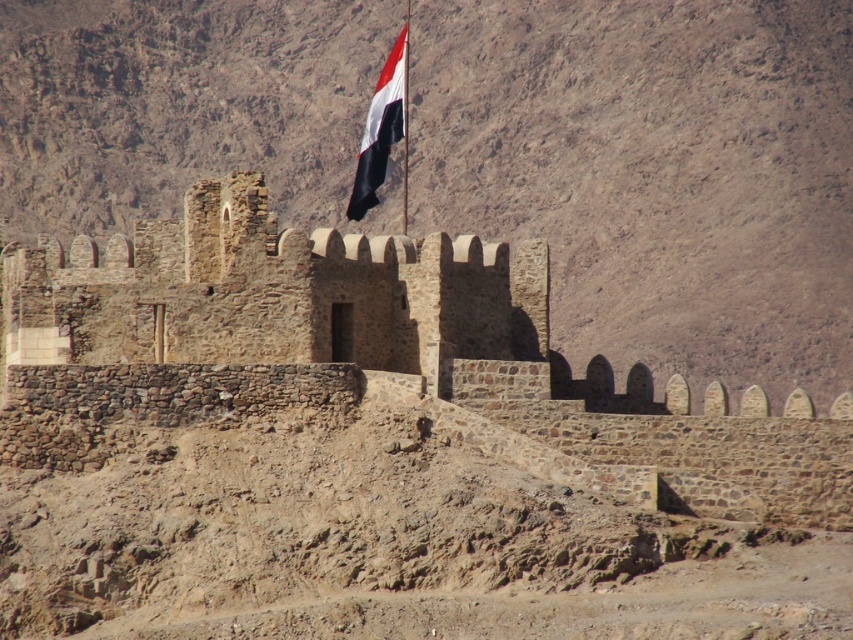
Is rustic stone castle at center wider than white fabric flag at upper center?

Correct, the width of rustic stone castle at center exceeds that of white fabric flag at upper center.

Which is below, rustic stone castle at center or white fabric flag at upper center?

rustic stone castle at center

Locate an element on the screen. This screenshot has height=640, width=853. rustic stone castle at center is located at coordinates (375, 358).

Is brown stone wall at center closer to camera compared to white fabric flag at upper center?

No.

Is brown stone wall at center above white fabric flag at upper center?

Yes.

Which is in front, point (691, 256) or point (393, 86)?

Point (393, 86) is in front.

Where is `brown stone wall at center`? The image size is (853, 640). brown stone wall at center is located at coordinates (653, 173).

This screenshot has height=640, width=853. Identify the location of brown stone wall at center. (653, 173).

Is point (28, 24) behind point (198, 182)?

Yes, point (28, 24) is behind point (198, 182).

Between point (834, 120) and point (396, 269), which one is positioned behind?

The point (834, 120) is more distant.

In order to click on brown stone wall at center in this screenshot , I will do 653,173.